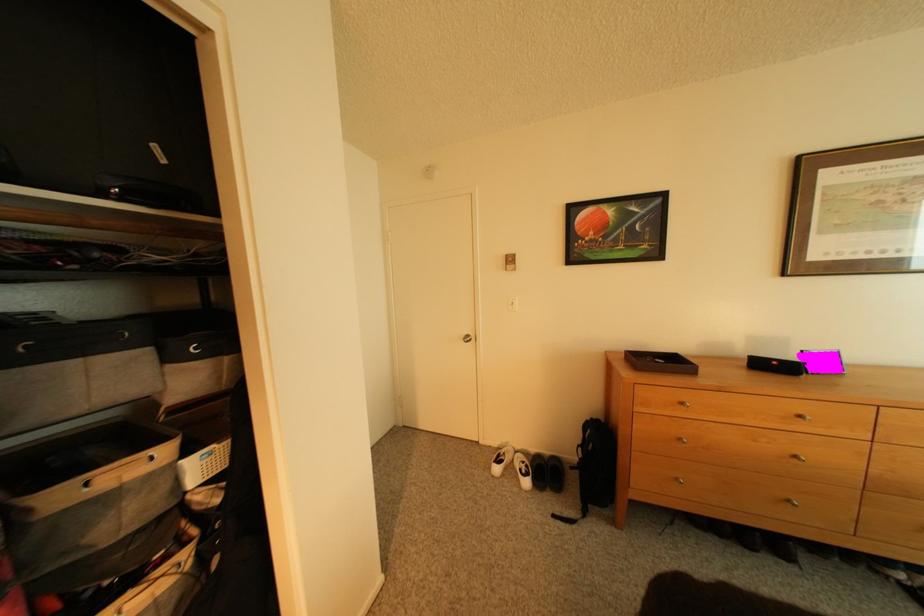
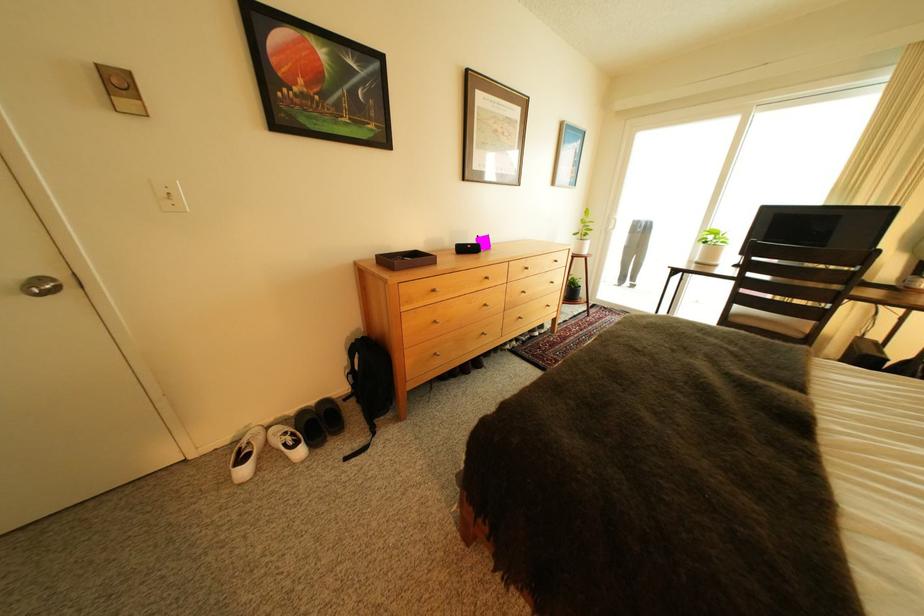
Locate, in the second image, the point that corresponds to (603,421) in the first image.

(369, 341)